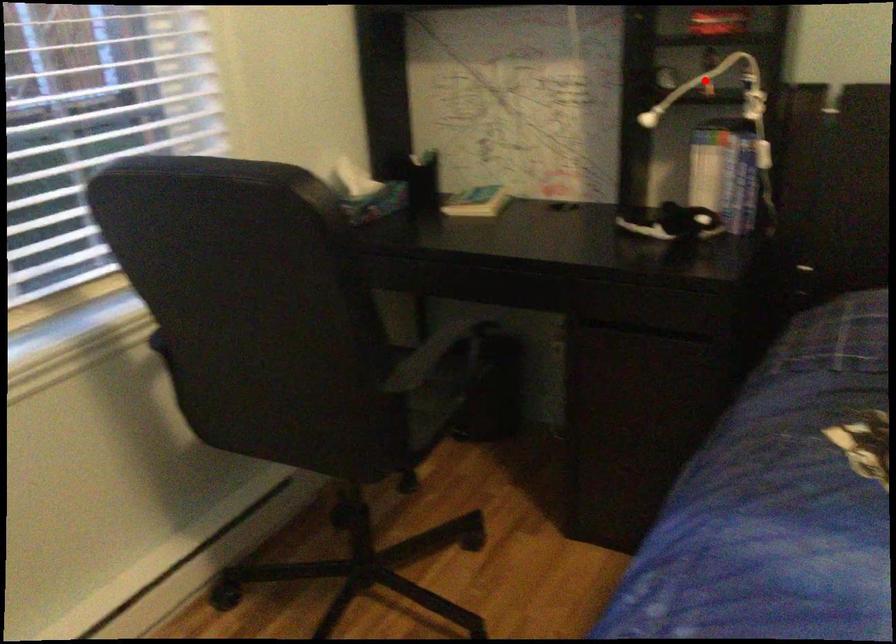
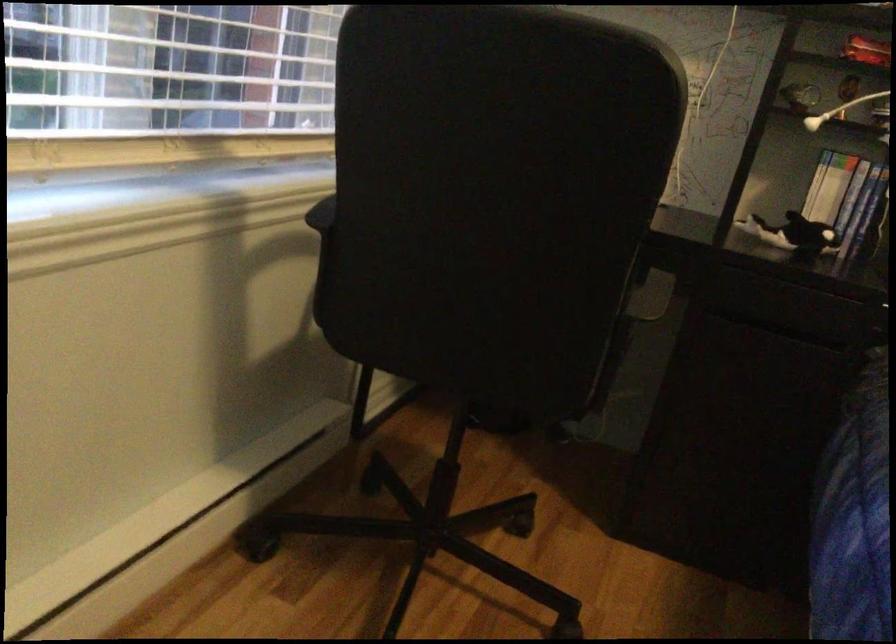
The point at the highlighted location is marked in the first image. Where is the corresponding point in the second image?

(839, 109)